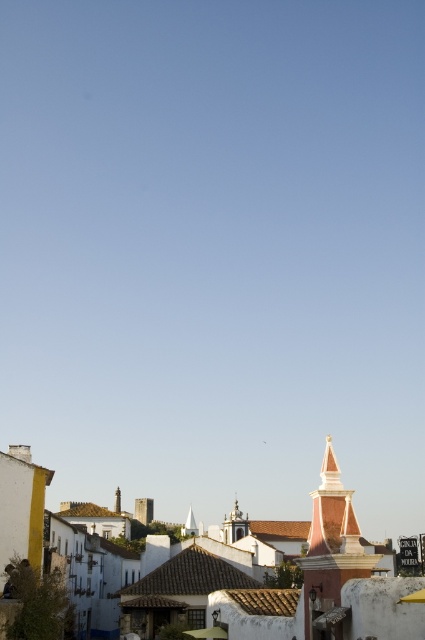
You are an architect planning to install a new communication antenna between the silver metallic tower at center and the white stucco spire at center. The antenna requires a minimum distance of 300 feet between its two support points. Can the existing structures accommodate this requirement?

The silver metallic tower at center and white stucco spire at center are 332.94 feet apart, which exceeds the minimum required distance of 300 feet. Therefore, the existing structures can accommodate the antenna installation.

You are an architect visiting the historic town. You notice two structures in the center of the image. The first is the smooth pink tower at center, and the second is the white stucco spire at center. From your vantage point, which of these two structures is positioned to the right?

The smooth pink tower at center is positioned to the right of the white stucco spire at center.